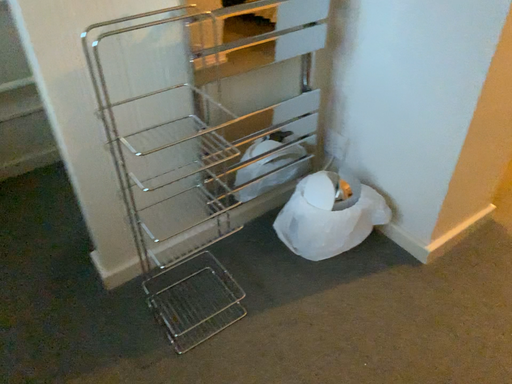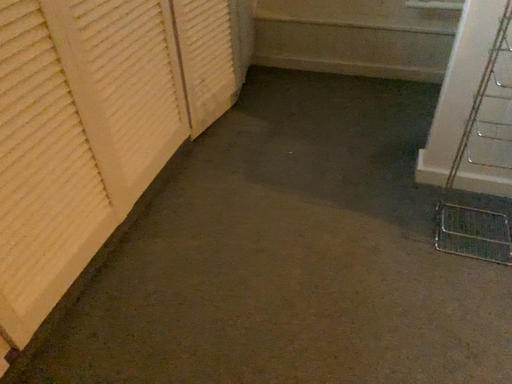
Question: How did the camera likely rotate when shooting the video?

Choices:
 (A) rotated upward
 (B) rotated downward

Answer: (A)